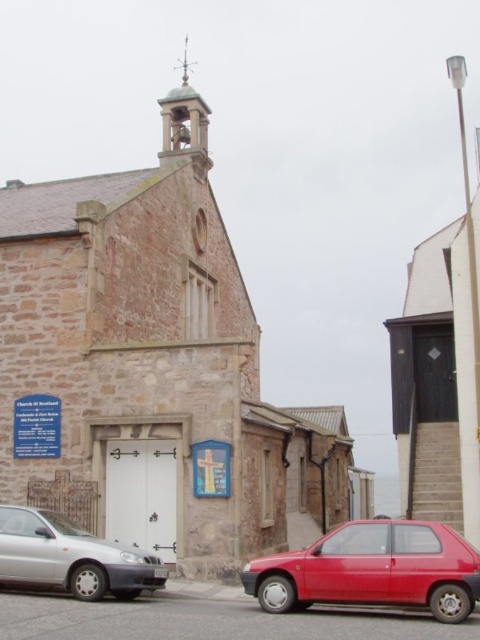
Question: Can you confirm if silver metallic car at lower left is smaller than metallic bell tower at upper center?

Choices:
 (A) yes
 (B) no

Answer: (A)

Question: Which of the following is the farthest from the observer?

Choices:
 (A) metallic bell tower at upper center
 (B) shiny red car at lower right

Answer: (A)

Question: Which of the following is the farthest from the observer?

Choices:
 (A) stone church at center
 (B) metallic bell tower at upper center
 (C) silver metallic car at lower left

Answer: (B)

Question: Is stone church at center wider than silver metallic car at lower left?

Choices:
 (A) yes
 (B) no

Answer: (A)

Question: Among these objects, which one is farthest from the camera?

Choices:
 (A) stone church at center
 (B) shiny red car at lower right
 (C) silver metallic car at lower left

Answer: (A)

Question: Is stone church at center above metallic bell tower at upper center?

Choices:
 (A) yes
 (B) no

Answer: (B)